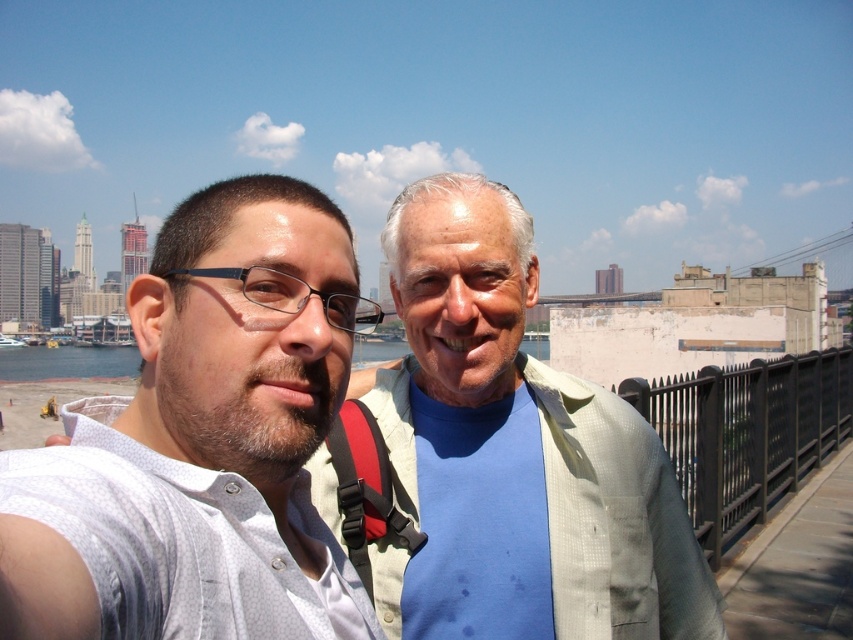
Is the position of white textured shirt at center less distant than that of light beige shirt at center?

Yes, it is in front of light beige shirt at center.

Can you confirm if white textured shirt at center is shorter than light beige shirt at center?

Yes.

Who is more distant from viewer, (332,307) or (409,268)?

Point (409,268)

The image size is (853, 640). What are the coordinates of `white textured shirt at center` in the screenshot? It's located at (206, 440).

Can you confirm if light beige shirt at center is shorter than clear blue water at center?

No, light beige shirt at center is not shorter than clear blue water at center.

Does point (323, 518) come farther from viewer compared to point (61, 356)?

No, (323, 518) is in front of (61, 356).

The height and width of the screenshot is (640, 853). In order to click on light beige shirt at center in this screenshot , I will do `click(514, 452)`.

Is point (184, 614) less distant than point (360, 352)?

Yes, point (184, 614) is closer to viewer.

This screenshot has height=640, width=853. What are the coordinates of `white textured shirt at center` in the screenshot? It's located at (206, 440).